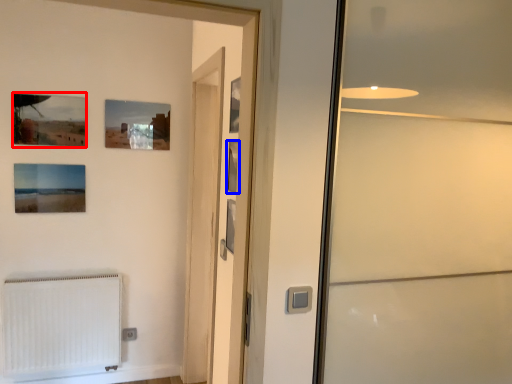
Question: Which object is closer to the camera taking this photo, picture frame (highlighted by a red box) or picture frame (highlighted by a blue box)?

Choices:
 (A) picture frame
 (B) picture frame

Answer: (B)